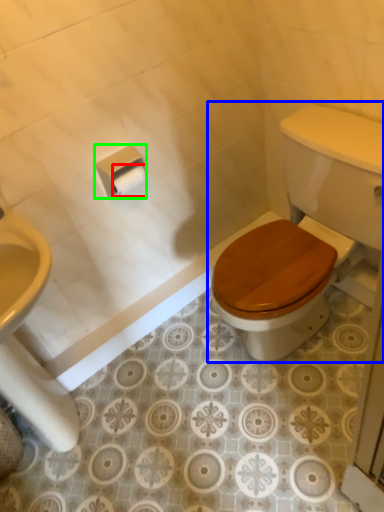
Question: Based on their relative distances, which object is farther from toilet paper (highlighted by a red box)? Choose from toilet (highlighted by a blue box) and toilet paper (highlighted by a green box).

Choices:
 (A) toilet
 (B) toilet paper

Answer: (A)